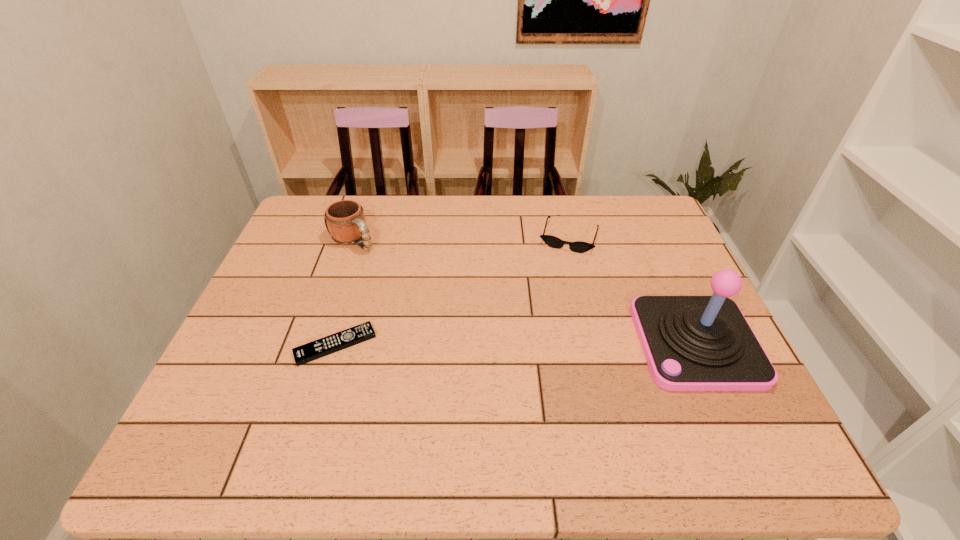
Where is `the shortest object`? the shortest object is located at coordinates (311, 351).

Identify the location of the rightmost object. (691, 343).

Locate an element on the screen. Image resolution: width=960 pixels, height=540 pixels. the tallest object is located at coordinates (691, 343).

The height and width of the screenshot is (540, 960). I want to click on mug, so click(x=346, y=224).

This screenshot has width=960, height=540. In order to click on the second object from right to left in this screenshot , I will do `click(579, 247)`.

Identify the location of the second shortest object. Image resolution: width=960 pixels, height=540 pixels. (579, 247).

Identify the location of vacant space located 0.390m on the back of the remote control. Image resolution: width=960 pixels, height=540 pixels. (370, 231).

The image size is (960, 540). I want to click on vacant region located 0.380m forward from the base of the joystick, so click(x=483, y=342).

Where is `vacant space situated 0.280m forward from the base of the joystick`? This screenshot has height=540, width=960. vacant space situated 0.280m forward from the base of the joystick is located at coordinates (524, 342).

Identify the location of vacant area situated 0.390m forward from the base of the joystick. Image resolution: width=960 pixels, height=540 pixels. click(478, 342).